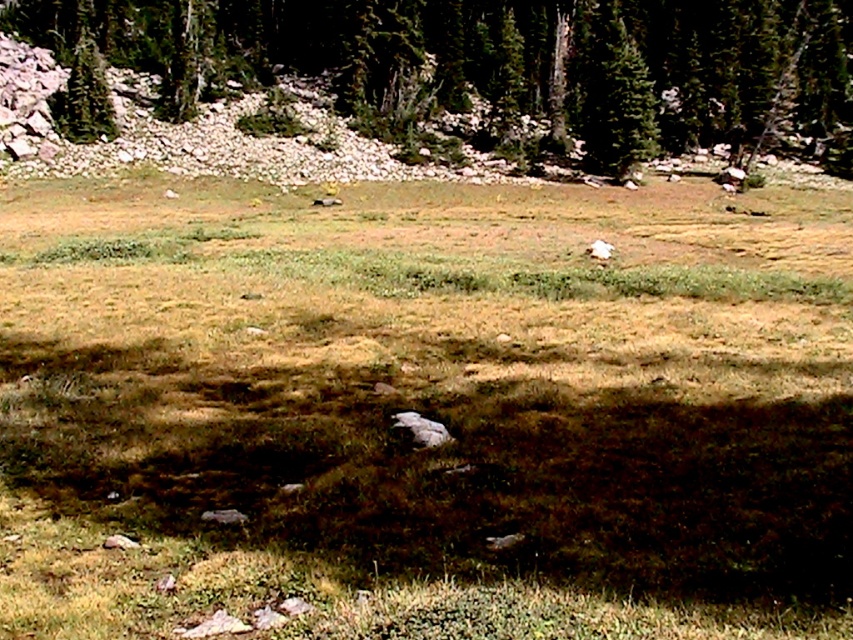
Question: Among these points, which one is farthest from the camera?

Choices:
 (A) (196, 29)
 (B) (613, 97)
 (C) (74, 88)

Answer: (A)

Question: Can you confirm if green grass at center is positioned above green matte tree at upper left?

Choices:
 (A) no
 (B) yes

Answer: (A)

Question: Which point appears farthest from the camera in this image?

Choices:
 (A) (78, 60)
 (B) (556, 97)
 (C) (705, 214)

Answer: (B)

Question: Is green textured tree at upper center bigger than green textured pine tree at upper center?

Choices:
 (A) yes
 (B) no

Answer: (A)

Question: Observing the image, what is the correct spatial positioning of green grass at center in reference to green textured pine tree at upper center?

Choices:
 (A) left
 (B) right

Answer: (A)

Question: Which point is closer to the camera?

Choices:
 (A) green grass at center
 (B) green textured tree at upper center

Answer: (A)